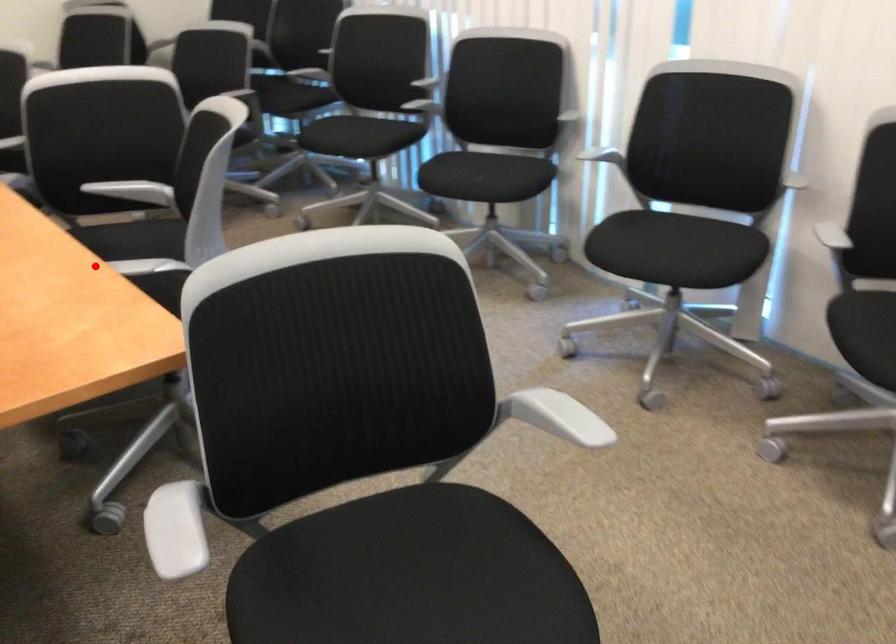
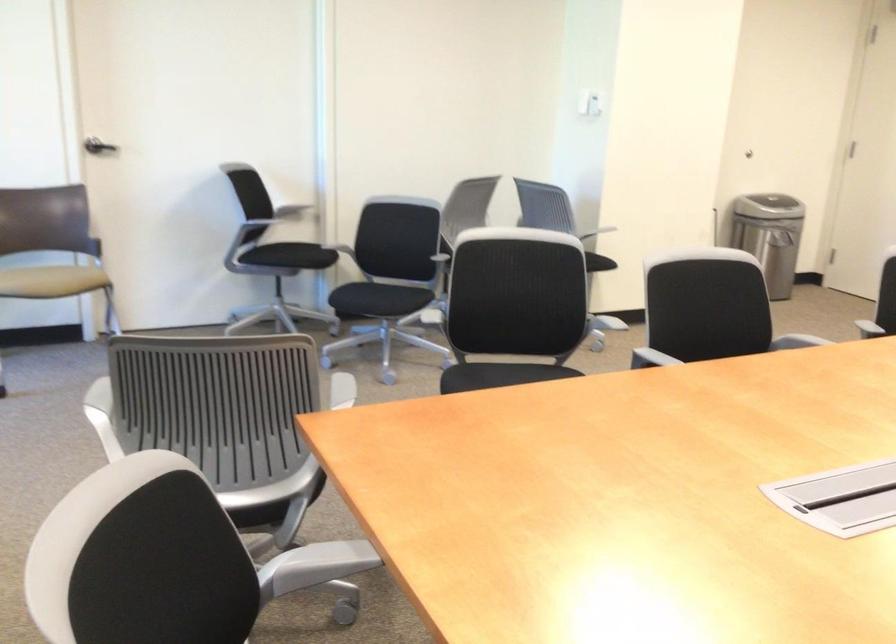
Question: I am providing you with two images of the same scene from different viewpoints. A red point is marked on the first image. Can you still see the location of the red point in image 2?

Choices:
 (A) Yes
 (B) No

Answer: (A)